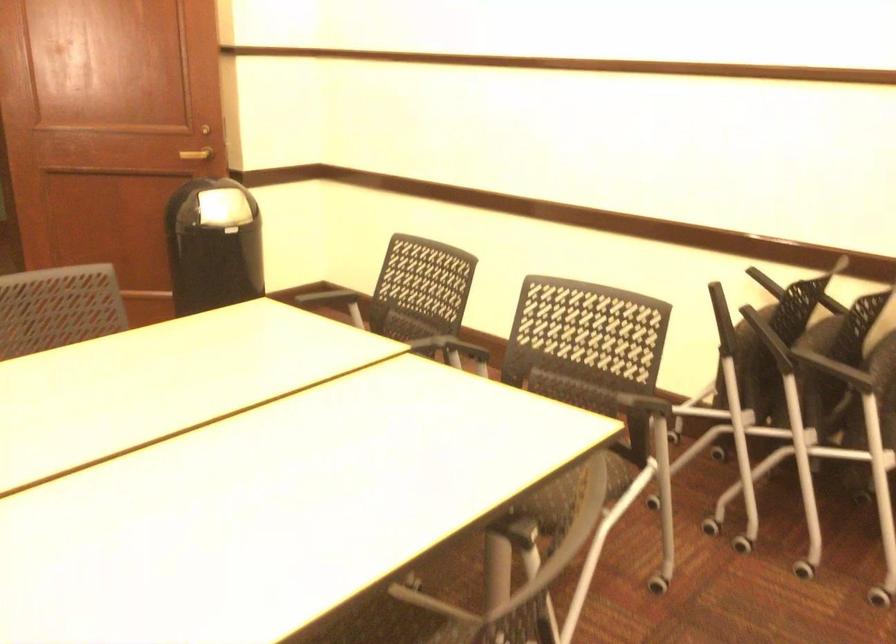
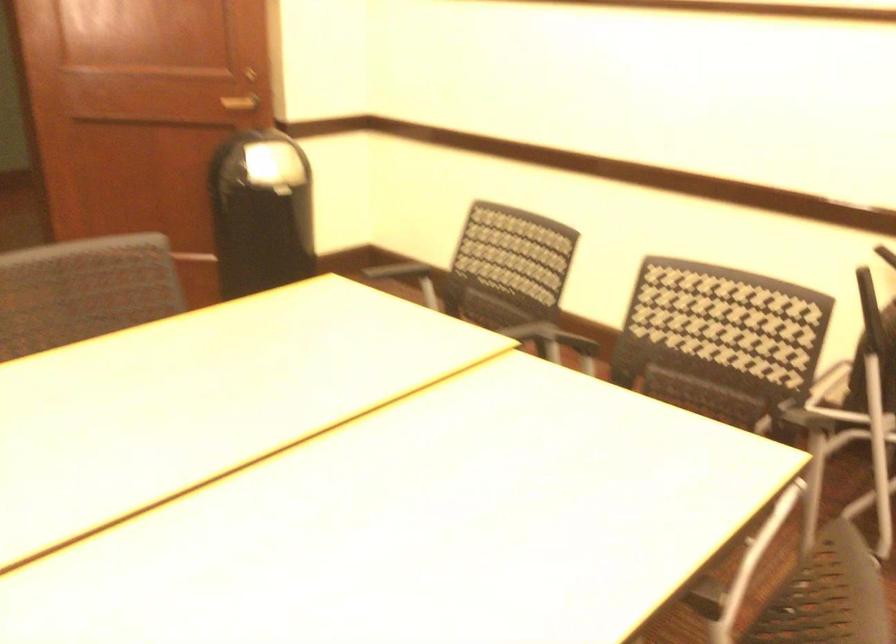
Question: Based on the continuous images, in which direction is the camera rotating? Reply with the corresponding letter.

Choices:
 (A) Left
 (B) Right
 (C) Up
 (D) Down

Answer: (D)